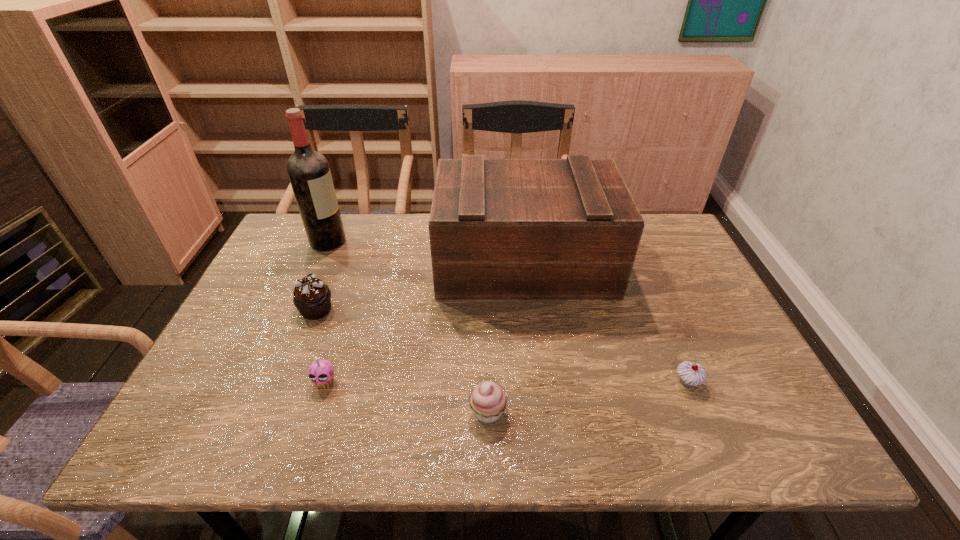
You are a GUI agent. You are given a task and a screenshot of the screen. Output one action in this format:
    pyautogui.click(x=<x>, y=<y>)
    Task: Click on the liquor
    The image size is (960, 540).
    Given the screenshot: What is the action you would take?
    pyautogui.click(x=308, y=170)

I want to click on box, so click(500, 229).

The height and width of the screenshot is (540, 960). I want to click on the leftmost cupcake, so click(312, 298).

At what (x,y) coordinates should I click in order to perform the action: click on the rightmost cupcake. Please return your answer as a coordinate pair (x, y). This screenshot has width=960, height=540. Looking at the image, I should click on coord(691,374).

What are the coordinates of `the third cupcake from left to right` in the screenshot? It's located at (488, 401).

You are a GUI agent. You are given a task and a screenshot of the screen. Output one action in this format:
    pyautogui.click(x=<x>, y=<y>)
    Task: Click on the fourth object from right to left
    
    Given the screenshot: What is the action you would take?
    pyautogui.click(x=321, y=372)

Locate an element on the screen. This screenshot has width=960, height=540. vacant space located 0.300m on the front-facing side of the tallest object is located at coordinates (443, 242).

Find the location of a particular element. This screenshot has height=540, width=960. free space located on the right of the fifth shortest object is located at coordinates (678, 262).

Where is `vacant space located 0.300m on the front of the leftmost cupcake`? This screenshot has height=540, width=960. vacant space located 0.300m on the front of the leftmost cupcake is located at coordinates (269, 431).

Identify the location of free spot located 0.230m on the back of the rightmost cupcake. (653, 301).